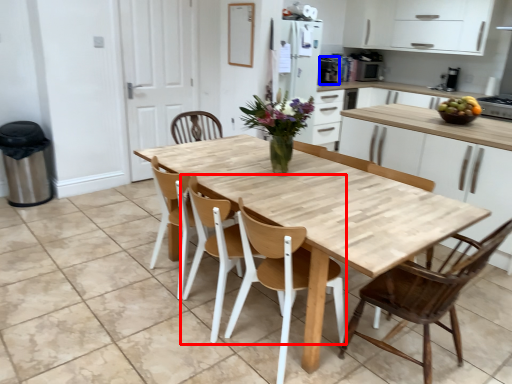
Question: Which object appears closest to the camera in this image, chair (highlighted by a red box) or appliance (highlighted by a blue box)?

Choices:
 (A) chair
 (B) appliance

Answer: (A)